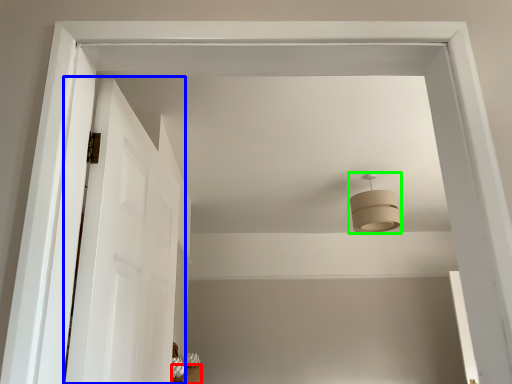
Question: Estimate the real-world distances between objects in this image. Which object is closer to furniture (highlighted by a red box), door (highlighted by a blue box) or fixture (highlighted by a green box)?

Choices:
 (A) door
 (B) fixture

Answer: (B)